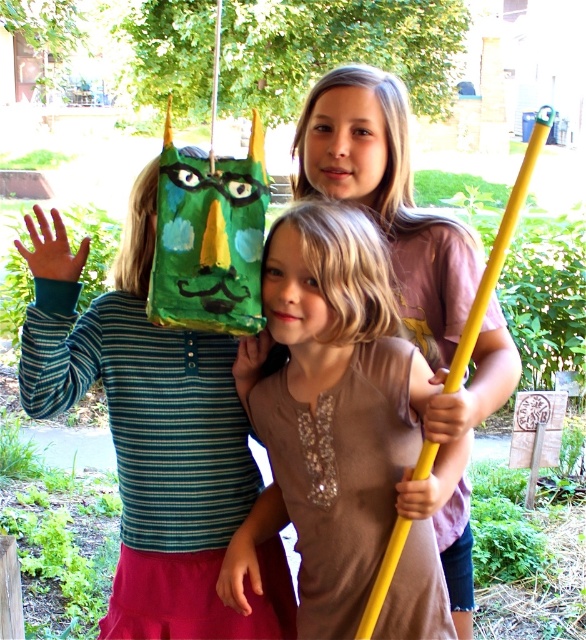
Question: Can you confirm if matte green paper bag at left is positioned to the right of matte pink shirt at center?

Choices:
 (A) yes
 (B) no

Answer: (B)

Question: Which is nearer to the matte green paper bag at left?

Choices:
 (A) matte pink shirt at center
 (B) matte brown shirt at center

Answer: (B)

Question: Which of these objects is positioned closest to the matte green paper bag at left?

Choices:
 (A) matte pink shirt at center
 (B) matte brown shirt at center

Answer: (B)

Question: Is matte brown shirt at center wider than matte green paper bag at left?

Choices:
 (A) no
 (B) yes

Answer: (A)

Question: Is matte green paper bag at left in front of matte pink shirt at center?

Choices:
 (A) yes
 (B) no

Answer: (A)

Question: Which of the following is the farthest from the observer?

Choices:
 (A) matte green paper bag at left
 (B) matte pink shirt at center
 (C) matte brown shirt at center

Answer: (C)